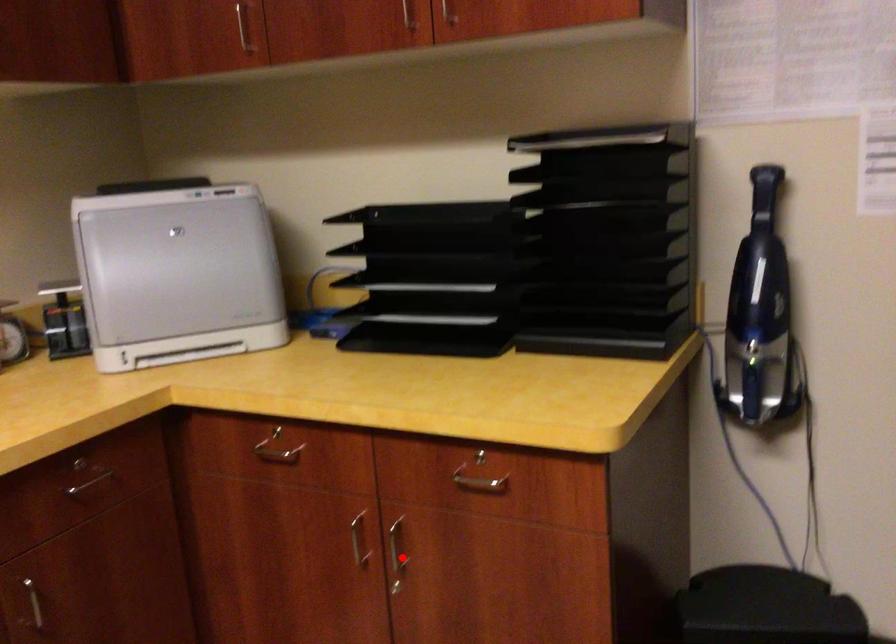
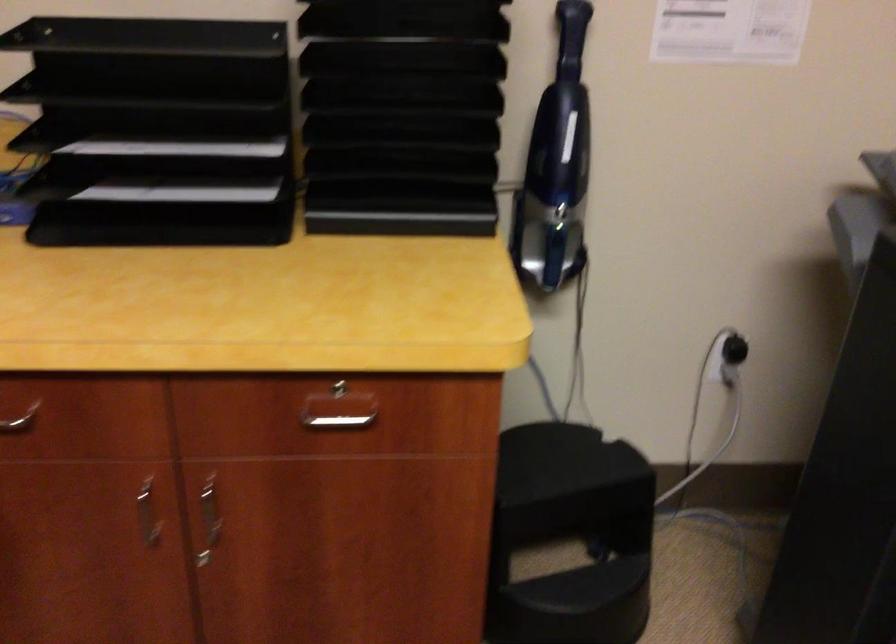
Find the pixel in the second image that matches the highlighted location in the first image.

(209, 520)